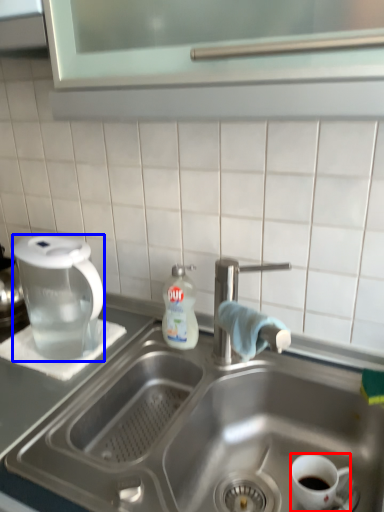
Question: Which of the following is the closest to the observer, coffee cup (highlighted by a red box) or coffee maker (highlighted by a blue box)?

Choices:
 (A) coffee cup
 (B) coffee maker

Answer: (A)